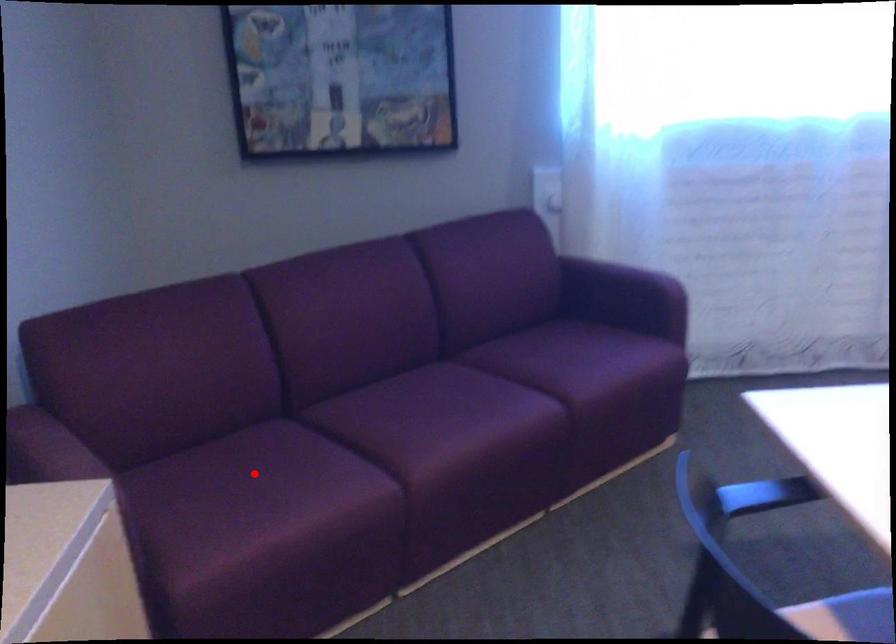
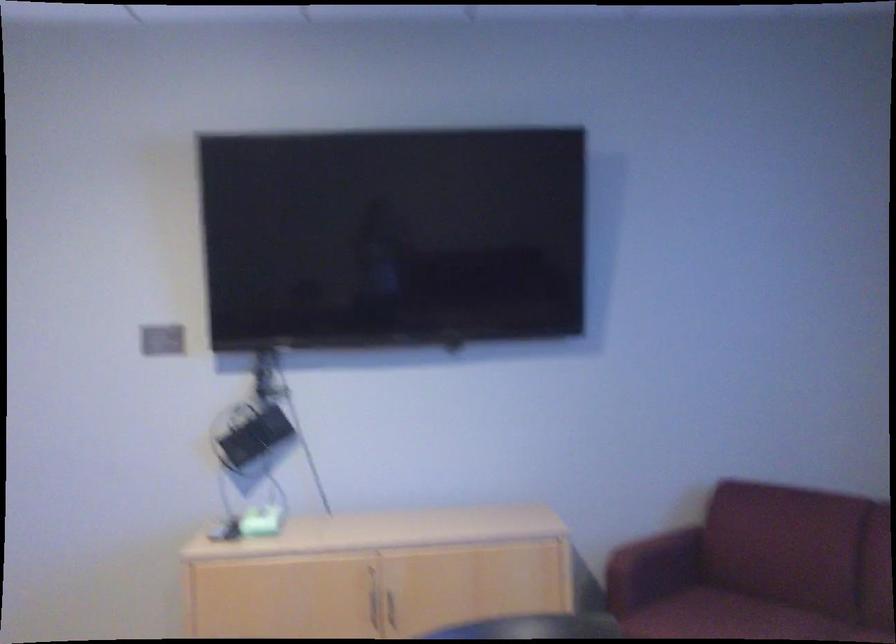
Where in the second image is the point corresponding to the highlighted location from the first image?

(722, 616)